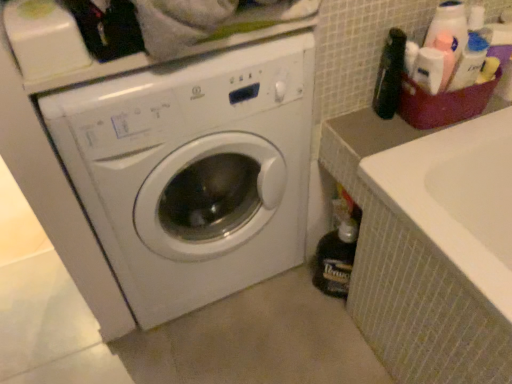
Question: Looking at their shapes, would you say white glossy washing machine at center is wider or thinner than plastic basket at upper right?

Choices:
 (A) thin
 (B) wide

Answer: (B)

Question: Do you think white glossy washing machine at center is within plastic basket at upper right, or outside of it?

Choices:
 (A) outside
 (B) inside

Answer: (A)

Question: Estimate the real-world distances between objects in this image. Which object is closer to the white glossy washing machine at center?

Choices:
 (A) dark brown glass bottle at lower right, the second bottle in the front-to-back sequence
 (B) black plastic bottle at upper right, which ranks as the 1th bottle in top-to-bottom order
 (C) plastic basket at upper right

Answer: (A)

Question: Estimate the real-world distances between objects in this image. Which object is farther from the dark brown glass bottle at lower right, which is the 1th bottle from back to front?

Choices:
 (A) plastic basket at upper right
 (B) black plastic bottle at upper right, which appears as the first bottle when viewed from the front
 (C) white glossy washing machine at center

Answer: (B)